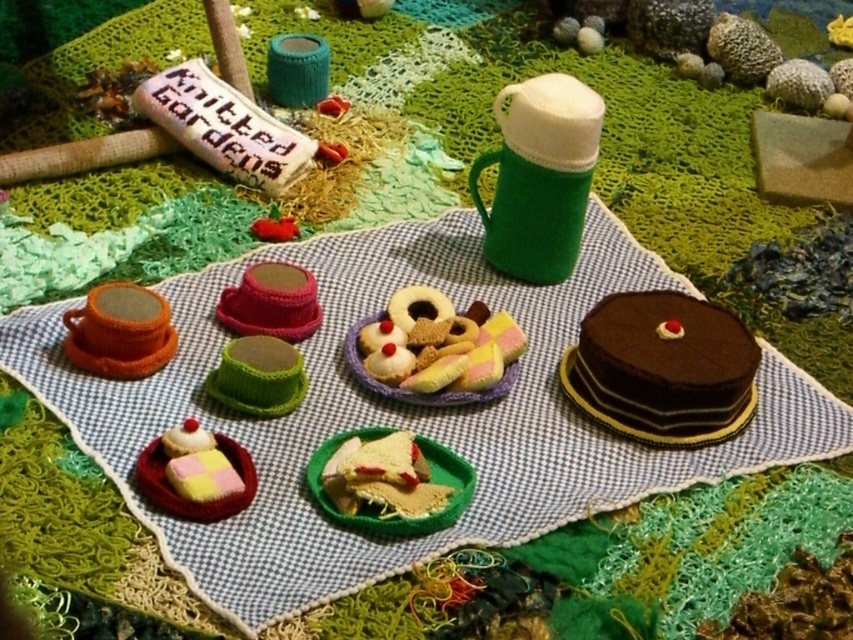
Question: Which point is closer to the camera?

Choices:
 (A) chocolate matte cake at center
 (B) pastel felt cookies at center
 (C) knitted fabric picnic blanket at center

Answer: (C)

Question: Can you confirm if knitted fabric picnic blanket at center is positioned below pastel felt cookies at center?

Choices:
 (A) yes
 (B) no

Answer: (A)

Question: Does knitted fabric picnic blanket at center have a greater width compared to pastel felt cookies at center?

Choices:
 (A) yes
 (B) no

Answer: (A)

Question: Which point appears farthest from the camera in this image?

Choices:
 (A) (619, 416)
 (B) (244, 588)
 (C) (505, 314)

Answer: (C)

Question: Which object appears closest to the camera in this image?

Choices:
 (A) chocolate matte cake at center
 (B) pastel felt cookies at center

Answer: (A)

Question: Is chocolate matte cake at center to the right of pastel felt cookies at center from the viewer's perspective?

Choices:
 (A) yes
 (B) no

Answer: (A)